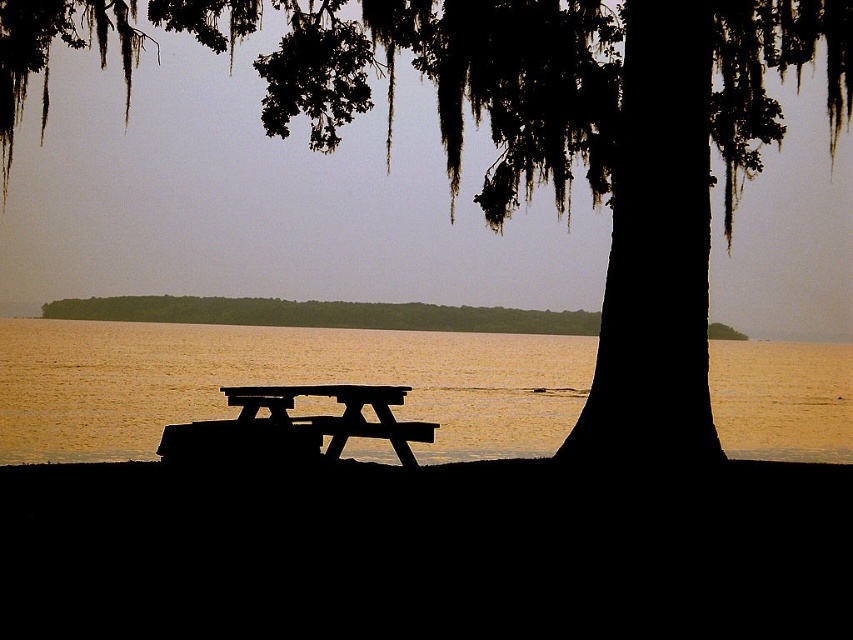
Question: Is golden sand water at center above black wood bench at center?

Choices:
 (A) no
 (B) yes

Answer: (A)

Question: Which point appears farthest from the camera in this image?

Choices:
 (A) (277, 358)
 (B) (300, 417)
 (C) (450, 48)

Answer: (A)

Question: Is golden sand water at center positioned behind black wood bench at center?

Choices:
 (A) no
 (B) yes

Answer: (A)

Question: Based on their relative distances, which object is nearer to the black wood bench at center?

Choices:
 (A) silhouette bark tree at center
 (B) golden sand water at center

Answer: (A)

Question: Which of the following is the closest to the observer?

Choices:
 (A) (712, 56)
 (B) (289, 387)

Answer: (A)

Question: Is golden sand water at center wider than black wood bench at center?

Choices:
 (A) no
 (B) yes

Answer: (B)